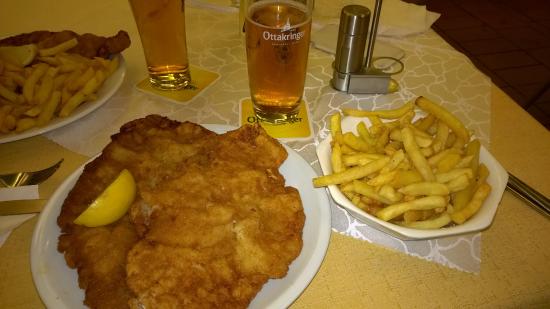
Image resolution: width=550 pixels, height=309 pixels. I want to click on glasses of beer, so click(285, 59), click(183, 44).